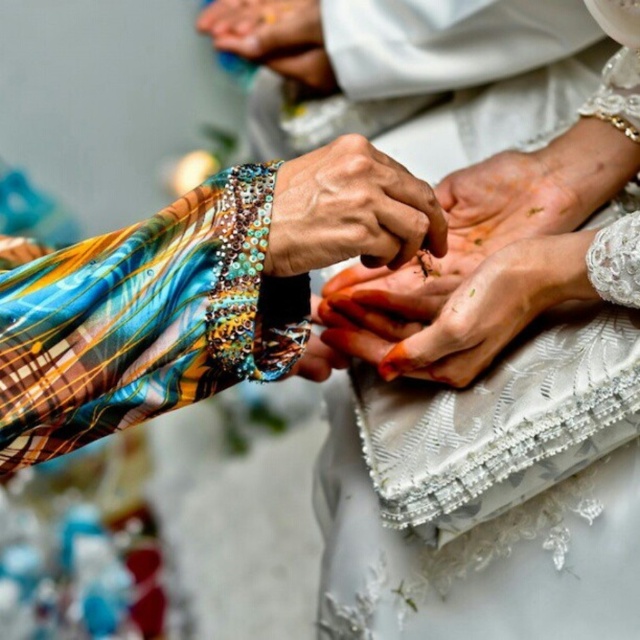
Question: Is dry skin at center positioned in front of matte white hands at center?

Choices:
 (A) yes
 (B) no

Answer: (A)

Question: Which of these objects is positioned closest to the multicolored fabric hand at center?

Choices:
 (A) matte white hands at center
 (B) dry skin at center
 (C) white lace dress at center

Answer: (B)

Question: Observing the image, what is the correct spatial positioning of multicolored fabric hand at center in reference to matte white hands at center?

Choices:
 (A) below
 (B) above

Answer: (A)

Question: Which point appears farthest from the camera in this image?

Choices:
 (A) (324, 250)
 (B) (186, 228)

Answer: (A)

Question: Which object is the farthest from the matte white hands at center?

Choices:
 (A) multicolored beaded bracelet at center
 (B) dry skin at center
 (C) white lace dress at center
 (D) multicolored fabric hand at center

Answer: (D)

Question: Is multicolored beaded bracelet at center in front of matte white hands at center?

Choices:
 (A) yes
 (B) no

Answer: (A)